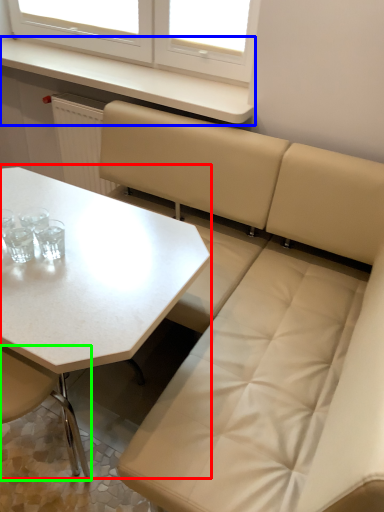
Question: Considering the real-world distances, which object is farthest from table (highlighted by a red box)? counter top (highlighted by a blue box) or chair (highlighted by a green box)?

Choices:
 (A) counter top
 (B) chair

Answer: (A)